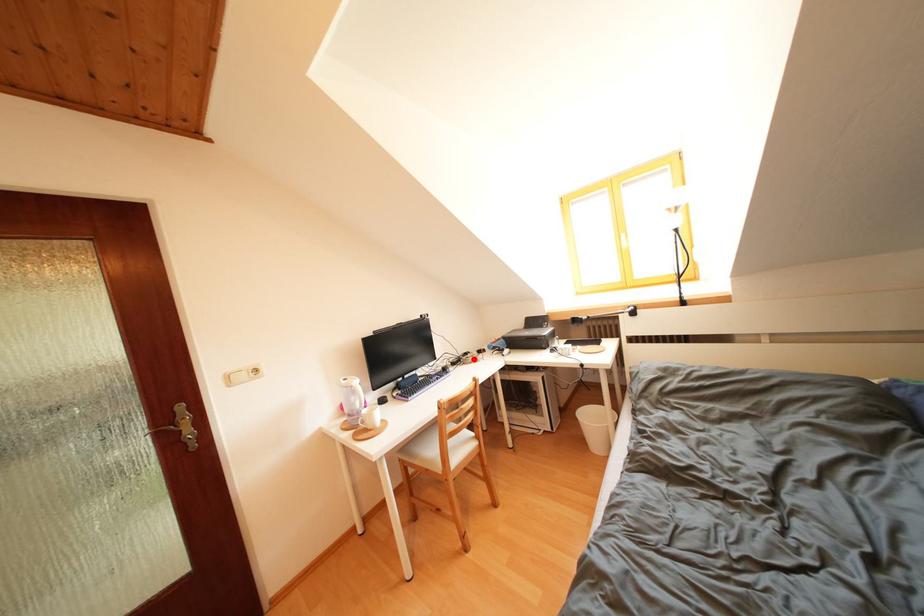
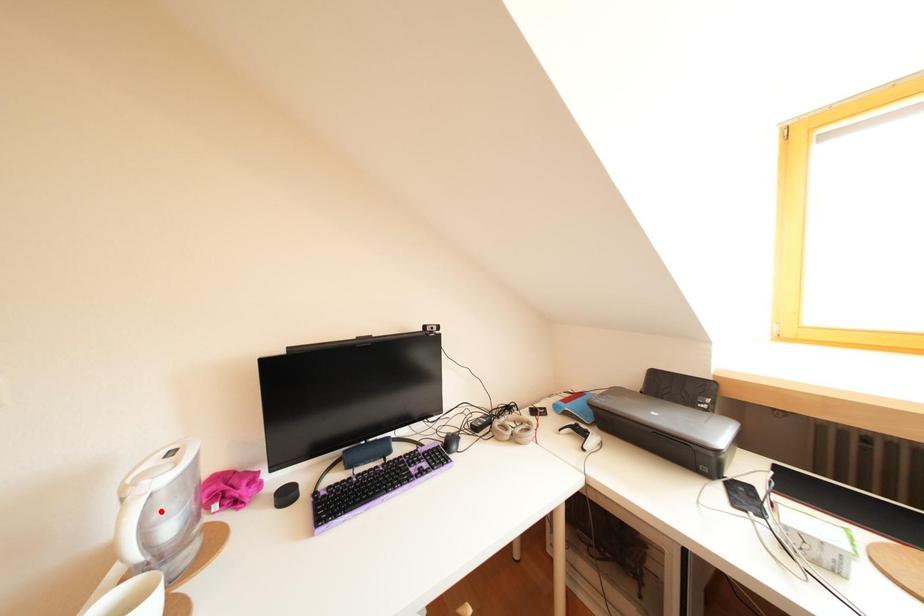
I am providing you with two images of the same scene from different viewpoints. A red point is marked on the first image and another point is marked on the second image. Is the red point in image1 aligned with the point shown in image2?

No